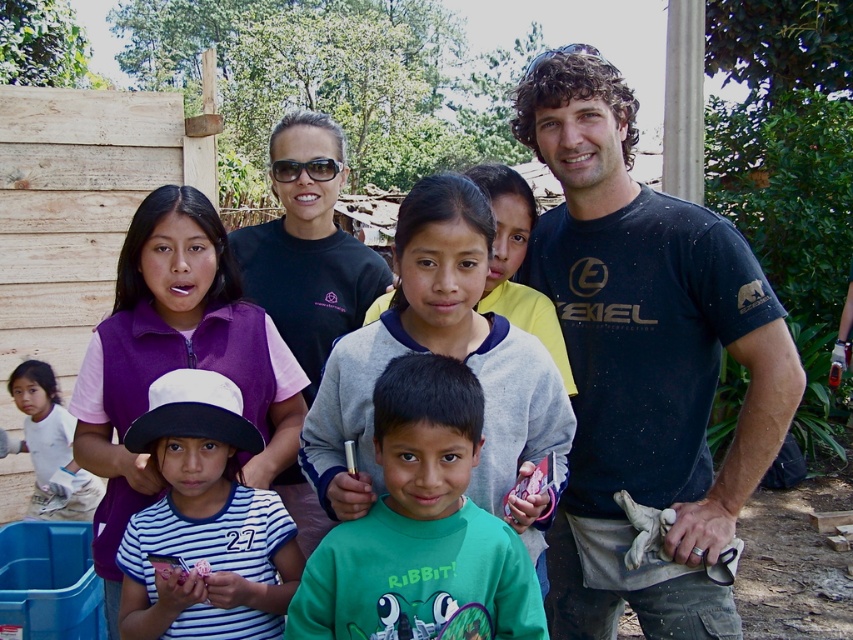
Is point (515, 346) behind point (144, 596)?

No, it is in front of (144, 596).

Who is taller, gray fleece sweater at center or white striped shirt at center?

Standing taller between the two is gray fleece sweater at center.

Between point (409, 202) and point (202, 452), which one is positioned in front?

Point (409, 202) is in front.

Identify the location of gray fleece sweater at center. The height and width of the screenshot is (640, 853). (439, 353).

This screenshot has height=640, width=853. Describe the element at coordinates (204, 522) in the screenshot. I see `white striped shirt at center` at that location.

Who is positioned more to the left, white striped shirt at center or matte black shirt at upper center?

Positioned to the left is white striped shirt at center.

Locate an element on the screen. The width and height of the screenshot is (853, 640). white striped shirt at center is located at coordinates (204, 522).

Is black cotton t-shirt at right positioned at the back of matte black shirt at upper center?

No, it is in front of matte black shirt at upper center.

Between point (598, 180) and point (300, 141), which one is positioned in front?

Point (598, 180) is more forward.

Which is in front, point (589, 480) or point (329, 296)?

Point (589, 480)

Find the location of a particular element. The image size is (853, 640). black cotton t-shirt at right is located at coordinates (645, 368).